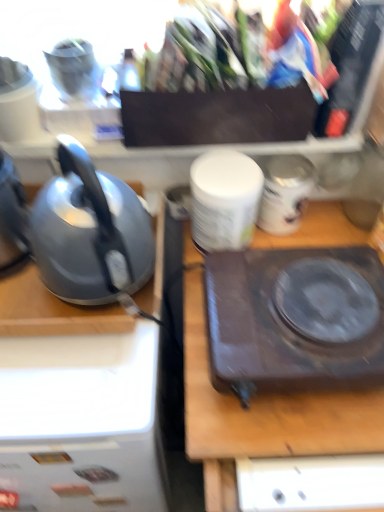
What do you see at coordinates (285, 192) in the screenshot? This screenshot has height=512, width=384. I see `white glossy jar at center` at bounding box center [285, 192].

You are a GUI agent. You are given a task and a screenshot of the screen. Output one action in this format:
    pyautogui.click(x=<x>, y=<y>)
    Task: Click on the white matte container at center
    This screenshot has width=384, height=512.
    Given the screenshot: What is the action you would take?
    pyautogui.click(x=224, y=199)

How far apart are brown matte electric stove at center and dark brown plastic hot plate at center?

A distance of 3.65 inches exists between brown matte electric stove at center and dark brown plastic hot plate at center.

Is point (261, 428) farther from viewer compared to point (319, 264)?

No, (261, 428) is in front of (319, 264).

Is brown matte electric stove at center next to dark brown plastic hot plate at center?

Absolutely, brown matte electric stove at center is next to and touching dark brown plastic hot plate at center.

Is brown matte electric stove at center aimed at dark brown plastic hot plate at center?

No, brown matte electric stove at center is not oriented towards dark brown plastic hot plate at center.

Looking at this image, from a real-world perspective, which is physically above, dark brown plastic hot plate at center or satin grey kettle at left?

From a 3D spatial view, satin grey kettle at left is above.

Which of these two, dark brown plastic hot plate at center or satin grey kettle at left, is smaller?

Smaller between the two is dark brown plastic hot plate at center.

Does dark brown plastic hot plate at center have a greater width compared to satin grey kettle at left?

Yes.

Is dark brown plastic hot plate at center facing towards satin grey kettle at left?

No, dark brown plastic hot plate at center is not facing towards satin grey kettle at left.

Which is behind, white glossy jar at center or white matte container at center?

white glossy jar at center is further away from the camera.

Considering the positions of point (259, 208) and point (218, 176), is point (259, 208) closer or farther from the camera than point (218, 176)?

Point (259, 208) is positioned farther from the camera compared to point (218, 176).

Would you say white glossy jar at center contains white matte container at center?

That's incorrect, white matte container at center is not inside white glossy jar at center.

From a real-world perspective, is white glossy jar at center physically below white matte container at center?

Yes, from a real-world perspective, white glossy jar at center is below white matte container at center.

From a real-world perspective, is white glossy jar at center over dark brown plastic hot plate at center?

Correct, in the physical world, white glossy jar at center is higher than dark brown plastic hot plate at center.

From the image's perspective, is white glossy jar at center on dark brown plastic hot plate at center?

Correct, white glossy jar at center appears higher than dark brown plastic hot plate at center in the image.

In the scene shown: Considering the relative sizes of white glossy jar at center and dark brown plastic hot plate at center in the image provided, is white glossy jar at center wider than dark brown plastic hot plate at center?

In fact, white glossy jar at center might be narrower than dark brown plastic hot plate at center.

Between white glossy jar at center and dark brown plastic hot plate at center, which one appears on the left side from the viewer's perspective?

dark brown plastic hot plate at center is more to the left.

From the image's perspective, which is above, white matte container at center or satin grey kettle at left?

white matte container at center, from the image's perspective.

Can you confirm if white matte container at center is smaller than satin grey kettle at left?

Correct, white matte container at center occupies less space than satin grey kettle at left.

Which is in front, point (215, 201) or point (86, 154)?

The point (215, 201) is closer.

Locate an element on the screen. Image resolution: width=384 pixels, height=512 pixels. kettle in front of the white matte container at center is located at coordinates (89, 232).

In the image, is satin grey kettle at left positioned in front of or behind dark brown plastic hot plate at center?

satin grey kettle at left is positioned closer to the viewer than dark brown plastic hot plate at center.

Is there a large distance between satin grey kettle at left and dark brown plastic hot plate at center?

No.

Identify the location of kitchen appliance below the satin grey kettle at left (from the image's perspective). The width and height of the screenshot is (384, 512). (296, 318).

From the image's perspective, who appears lower, satin grey kettle at left or dark brown plastic hot plate at center?

dark brown plastic hot plate at center.

Considering the relative sizes of dark brown plastic hot plate at center and white matte container at center in the image provided, is dark brown plastic hot plate at center shorter than white matte container at center?

Yes, dark brown plastic hot plate at center is shorter than white matte container at center.

Considering the positions of objects dark brown plastic hot plate at center and white matte container at center in the image provided, who is more to the left, dark brown plastic hot plate at center or white matte container at center?

Positioned to the left is white matte container at center.

Locate an element on the screen. kitchen appliance below the white matte container at center (from a real-world perspective) is located at coordinates (296, 318).

Is white matte container at center inside dark brown plastic hot plate at center?

No, white matte container at center is not a part of dark brown plastic hot plate at center.

Find the location of `kitchen appliance above the brown matte electric stove at center (from the image's perspective)`. kitchen appliance above the brown matte electric stove at center (from the image's perspective) is located at coordinates tap(296, 318).

Where is `kettle that appears in front of the dark brown plastic hot plate at center`? kettle that appears in front of the dark brown plastic hot plate at center is located at coordinates (89, 232).

Based on their spatial positions, is brown matte electric stove at center or white glossy jar at center further from satin grey kettle at left?

The object further to satin grey kettle at left is white glossy jar at center.

When comparing their distances from dark brown plastic hot plate at center, does white glossy jar at center or satin grey kettle at left seem closer?

satin grey kettle at left is closer to dark brown plastic hot plate at center.

From the image, which object appears to be farther from white glossy jar at center, dark brown plastic hot plate at center or white matte container at center?

The object further to white glossy jar at center is dark brown plastic hot plate at center.

From the image, which object appears to be farther from white matte container at center, brown matte electric stove at center or satin grey kettle at left?

Based on the image, satin grey kettle at left appears to be further to white matte container at center.

Considering their positions, is white glossy jar at center positioned closer to satin grey kettle at left than white matte container at center?

white matte container at center is positioned closer to the anchor satin grey kettle at left.

Looking at the image, which one is located further to white glossy jar at center, white matte container at center or dark brown plastic hot plate at center?

Based on the image, dark brown plastic hot plate at center appears to be further to white glossy jar at center.

Estimate the real-world distances between objects in this image. Which object is further from white glossy jar at center, dark brown plastic hot plate at center or satin grey kettle at left?

satin grey kettle at left is positioned further to the anchor white glossy jar at center.

Estimate the real-world distances between objects in this image. Which object is closer to white glossy jar at center, brown matte electric stove at center or satin grey kettle at left?

brown matte electric stove at center is positioned closer to the anchor white glossy jar at center.

The height and width of the screenshot is (512, 384). What are the coordinates of `kitchen appliance between white glossy jar at center and brown matte electric stove at center in the vertical direction` in the screenshot? It's located at [x=296, y=318].

Where is `tableware between satin grey kettle at left and dark brown plastic hot plate at center from left to right`? tableware between satin grey kettle at left and dark brown plastic hot plate at center from left to right is located at coordinates (224, 199).

The width and height of the screenshot is (384, 512). Identify the location of kitchen appliance located between satin grey kettle at left and brown matte electric stove at center in the left-right direction. (296, 318).

Locate an element on the screen. This screenshot has height=512, width=384. kitchen appliance between white matte container at center and brown matte electric stove at center vertically is located at coordinates (296, 318).